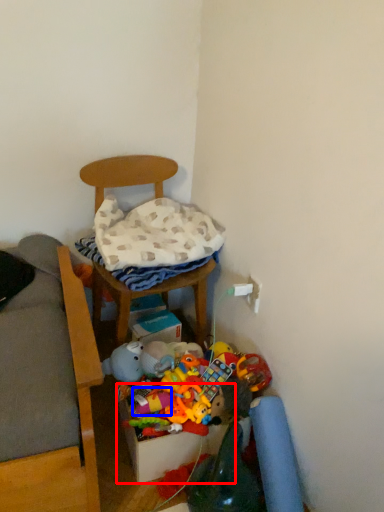
Question: Which object is closer to the camera taking this photo, storage box (highlighted by a red box) or toy (highlighted by a blue box)?

Choices:
 (A) storage box
 (B) toy

Answer: (A)